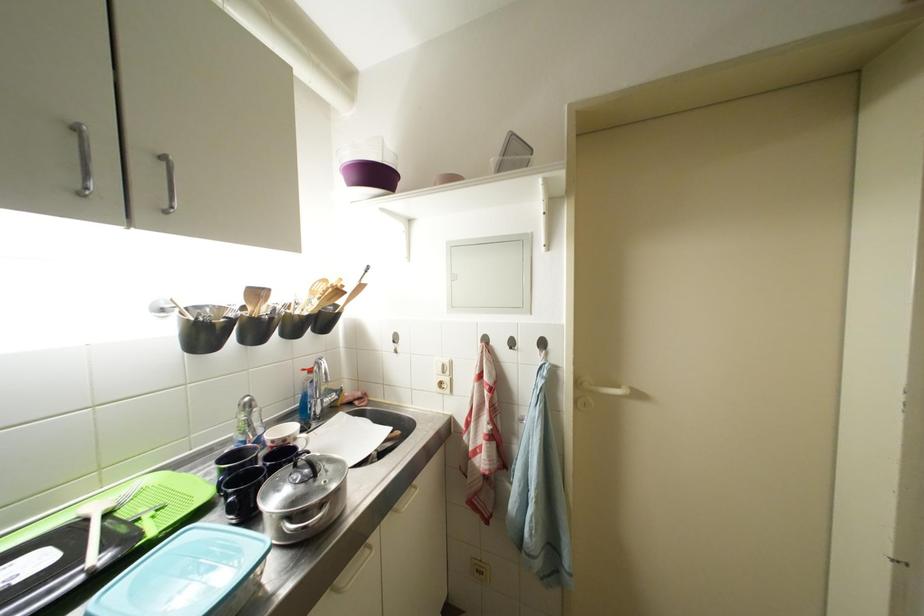
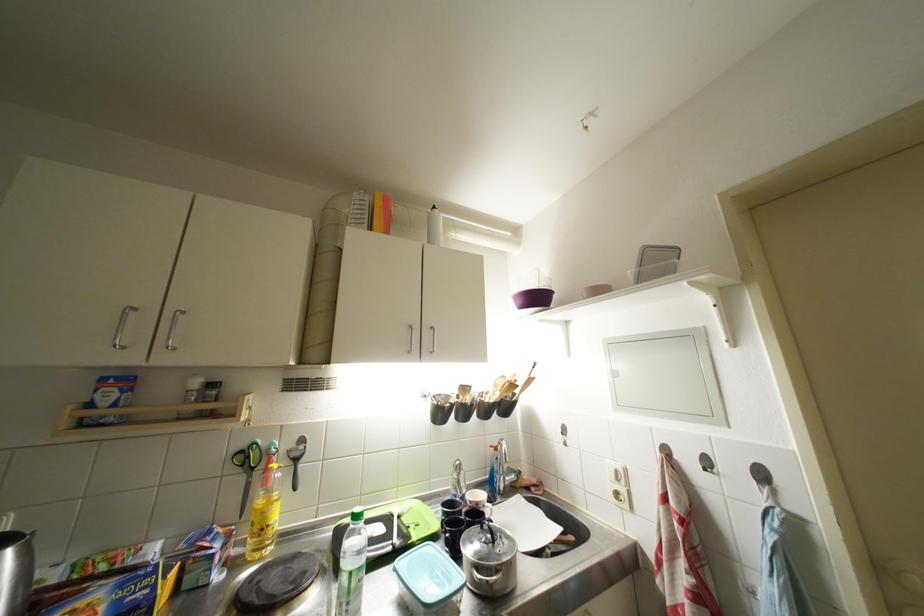
Where in the second image is the point corresponding to point (322, 480) from the first image?

(500, 546)